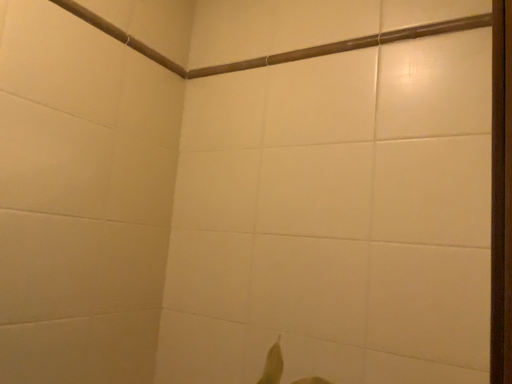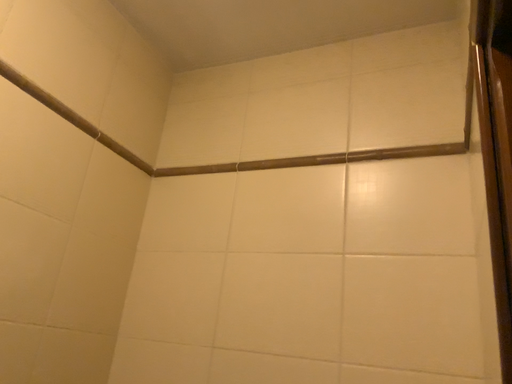
Question: How did the camera likely rotate when shooting the video?

Choices:
 (A) rotated upward
 (B) rotated downward

Answer: (A)